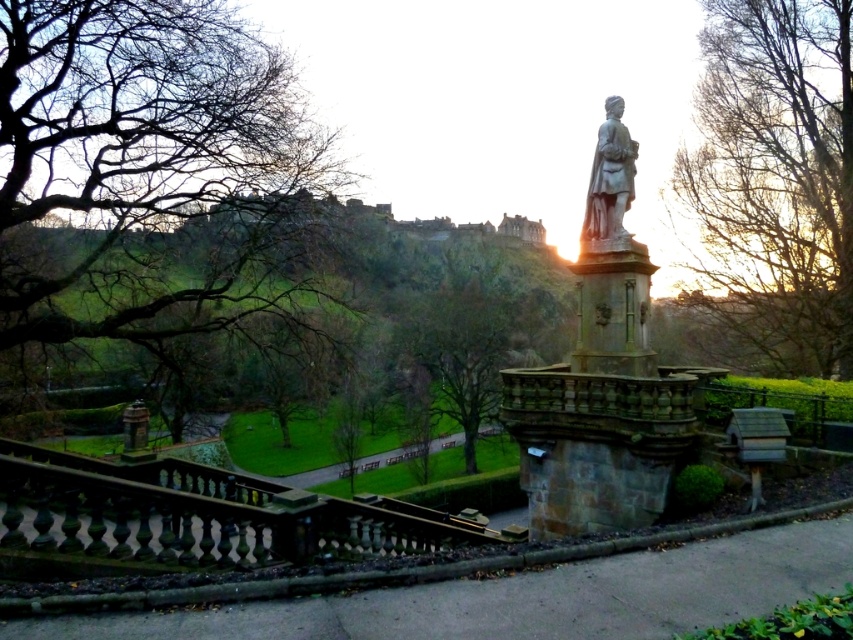
Question: Which of the following is the closest to the observer?

Choices:
 (A) bare branches at upper left
 (B) bare branches at upper right

Answer: (A)

Question: Is bare branches at upper right thinner than gray stone statue at center?

Choices:
 (A) no
 (B) yes

Answer: (A)

Question: Does bare branches at upper left appear on the left side of gray stone statue at center?

Choices:
 (A) yes
 (B) no

Answer: (A)

Question: Which point is farther from the camera taking this photo?

Choices:
 (A) (596, 186)
 (B) (780, 273)
 (C) (71, 56)

Answer: (B)

Question: Can you confirm if bare branches at upper left is thinner than bare branches at upper right?

Choices:
 (A) yes
 (B) no

Answer: (B)

Question: Which is farther from the bare branches at upper left?

Choices:
 (A) bare branches at upper right
 (B) gray stone statue at center

Answer: (A)